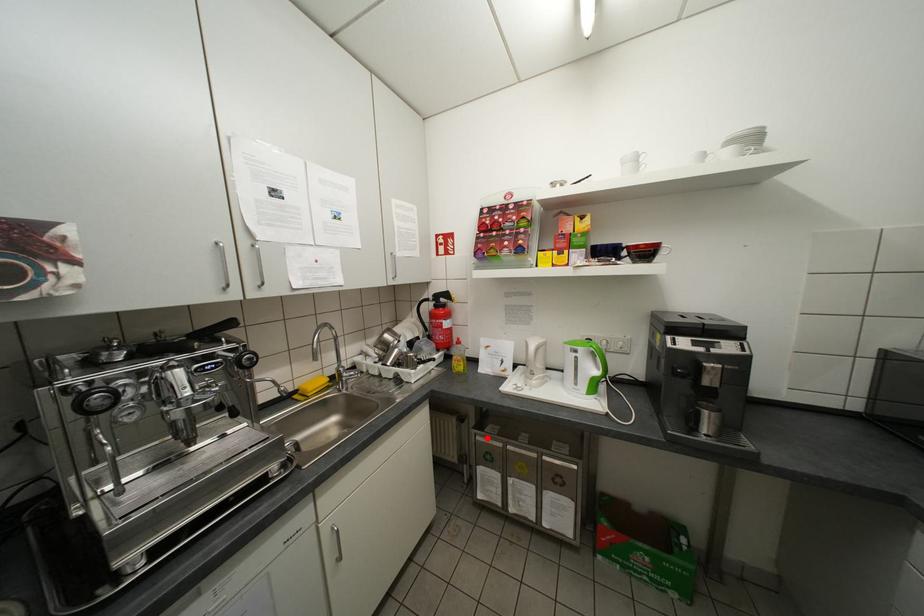
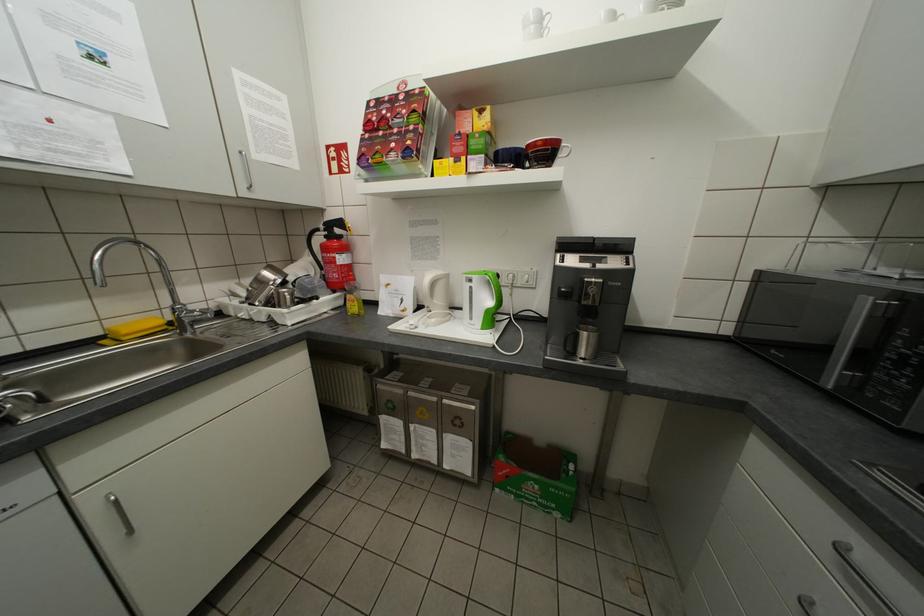
Question: A red point is marked in image1. In image2, is the corresponding 3D point closer to the camera or farther? Reply with the corresponding letter.

Choices:
 (A) The corresponding 3D point is closer.
 (B) The corresponding 3D point is farther.

Answer: (A)